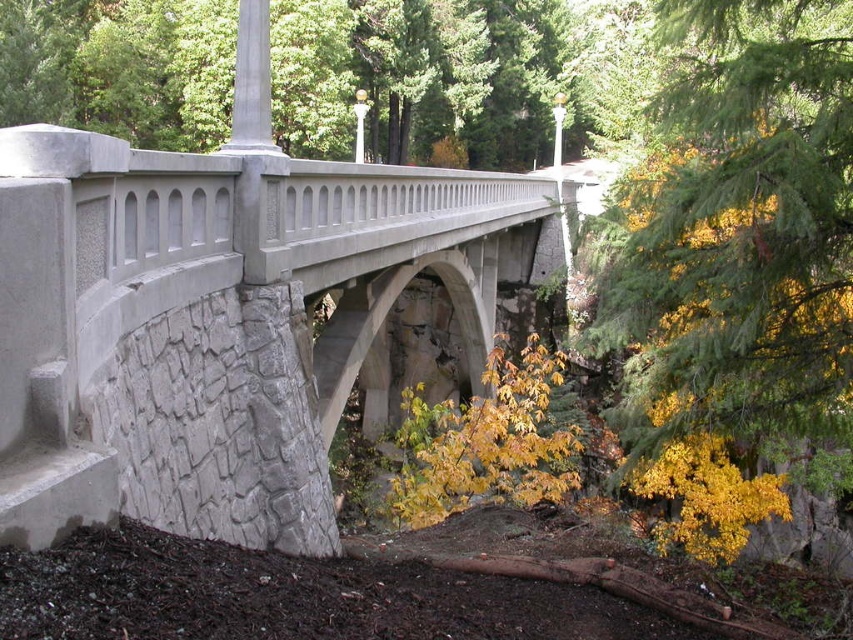
Question: Which point is farther to the camera?

Choices:
 (A) (625, 248)
 (B) (161, 337)

Answer: (A)

Question: Which point is farther to the camera?

Choices:
 (A) tap(709, 248)
 (B) tap(6, 422)

Answer: (A)

Question: Is the position of smooth concrete bridge at center less distant than that of yellow-green foliage at right?

Choices:
 (A) no
 (B) yes

Answer: (B)

Question: Is smooth concrete bridge at center to the left of yellow-green foliage at right from the viewer's perspective?

Choices:
 (A) no
 (B) yes

Answer: (B)

Question: Where is smooth concrete bridge at center located in relation to yellow-green foliage at right in the image?

Choices:
 (A) above
 (B) below

Answer: (B)